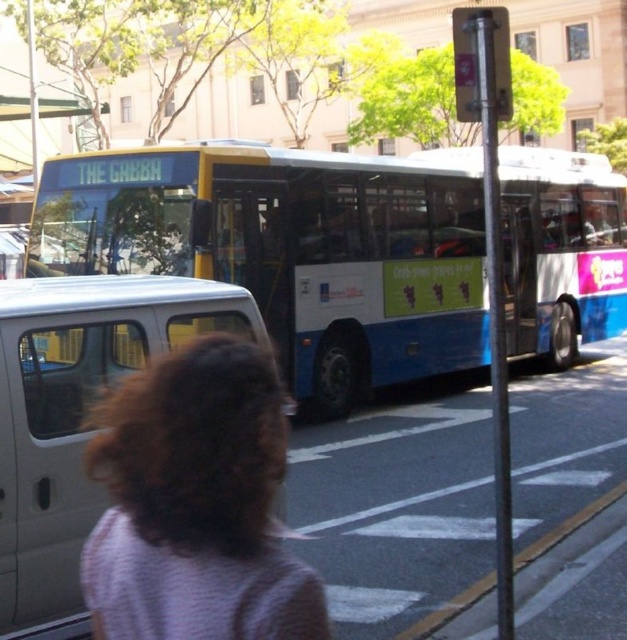
You are standing at the point marked as point (566, 184) and want to cross the street to reach the bus. The bus is 45.42 feet away from you. If you walk at a speed of 3 feet per second, how many seconds will it take you to reach the bus?

The distance between you and the bus is 45.42 feet, and walking at 3 feet per second, it will take 15.14 seconds to reach the bus.

Consider the image. You are a delivery driver who needs to park your white matte van at left behind the blue matte bus at center. Can your van fit under the bus without hitting the roof?

The blue matte bus at center is taller than the white matte van at left, so the van can fit under the bus without hitting the roof since the bus has more vertical clearance.

You are a pedestrian standing on the sidewalk and see the blue matte bus at center and the white matte van at left. Which vehicle is larger in size?

The blue matte bus at center is bigger than the white matte van at left.